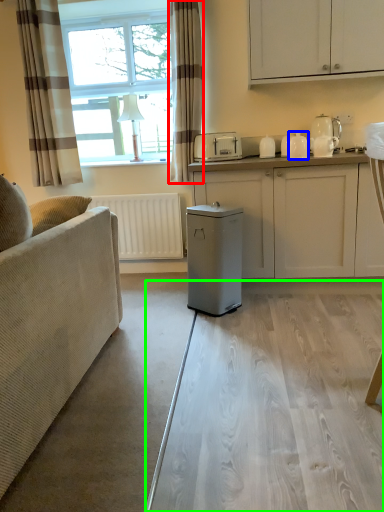
Question: Considering the real-world distances, which object is farthest from curtain (highlighted by a red box)? appliance (highlighted by a blue box) or glass table (highlighted by a green box)?

Choices:
 (A) appliance
 (B) glass table

Answer: (B)